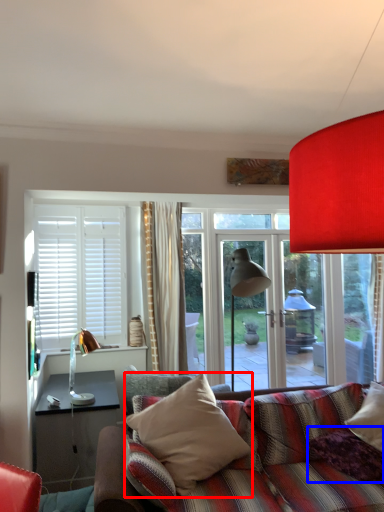
Question: Which object is further to the camera taking this photo, pillow (highlighted by a red box) or pillow (highlighted by a blue box)?

Choices:
 (A) pillow
 (B) pillow

Answer: (B)